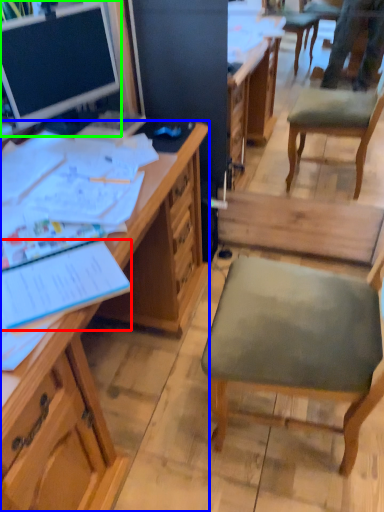
Question: Which is nearer to the notebook (highlighted by a red box)? desk (highlighted by a blue box) or desk (highlighted by a green box).

Choices:
 (A) desk
 (B) desk

Answer: (A)